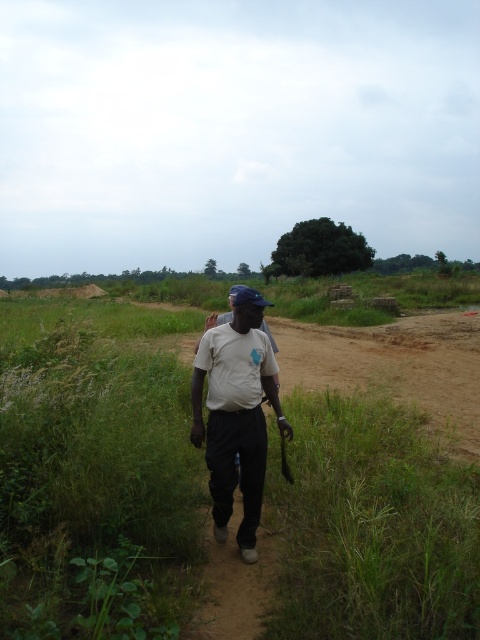
Question: Which object appears closest to the camera in this image?

Choices:
 (A) green grass at center
 (B) dirt path at center

Answer: (A)

Question: Is green grass at center closer to the viewer compared to dirt path at center?

Choices:
 (A) yes
 (B) no

Answer: (A)

Question: Based on their relative distances, which object is nearer to the white matte shirt at center?

Choices:
 (A) green grass at center
 (B) dirt path at center

Answer: (B)

Question: Can you confirm if green grass at center is positioned below dirt path at center?

Choices:
 (A) no
 (B) yes

Answer: (A)

Question: Considering the real-world distances, which object is farthest from the white matte shirt at center?

Choices:
 (A) dirt path at center
 (B) green grass at center

Answer: (B)

Question: Can you confirm if green grass at center is bigger than white matte shirt at center?

Choices:
 (A) no
 (B) yes

Answer: (B)